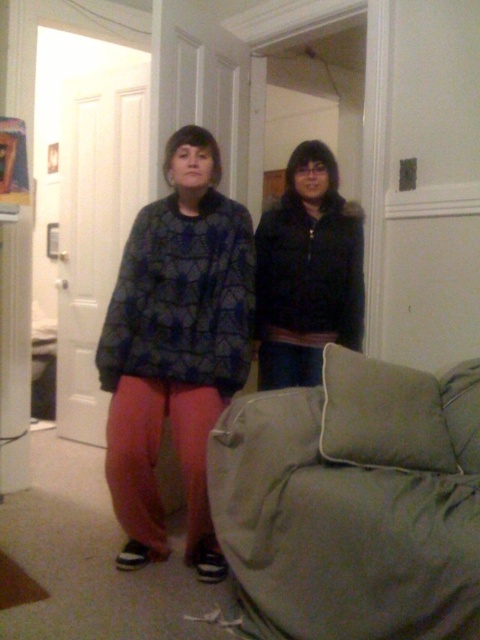
You are standing in the living room and want to sit on the sage green fabric couch at lower right. Which direction should you walk from your current position at point (354, 502) to reach it?

Since point (354, 502) marks the sage green fabric couch at lower right, you are already at the couch and do not need to move.

You are a fashion designer analyzing the image. You need to place a new accessory exactly at the center of the matte black jacket at center. What are the coordinates where you should place the accessory?

The coordinates for the center of the matte black jacket at center are given as point (176, 346), so the accessory should be placed at those coordinates.

You are designing a layout for a clothing store display. You have two jackets, the matte black jacket at center and the black matte jacket at center. Based on their positions in the image, which one should you place lower on the rack to match the scene?

The matte black jacket at center should be placed lower on the rack because it is positioned below the black matte jacket at center in the image.